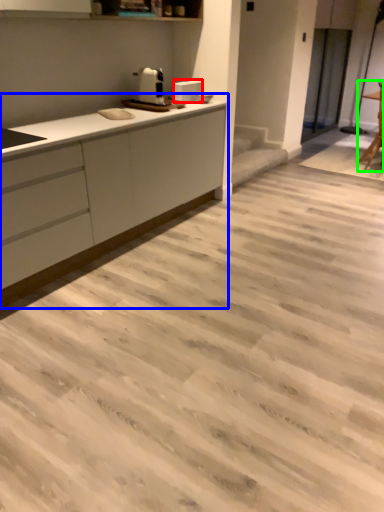
Question: Which object is positioned farthest from appliance (highlighted by a red box)? Select from countertop (highlighted by a blue box) and chair (highlighted by a green box).

Choices:
 (A) countertop
 (B) chair

Answer: (B)